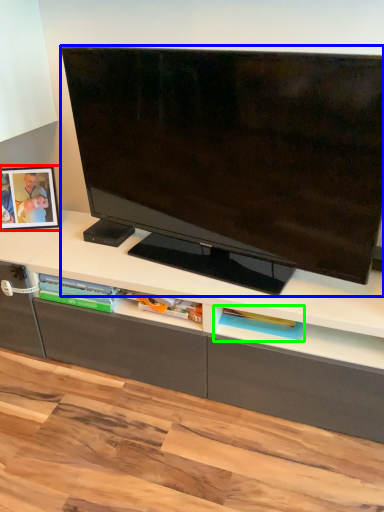
Question: Estimate the real-world distances between objects in this image. Which object is farther from picture frame (highlighted by a red box), television (highlighted by a blue box) or shelf (highlighted by a green box)?

Choices:
 (A) television
 (B) shelf

Answer: (B)